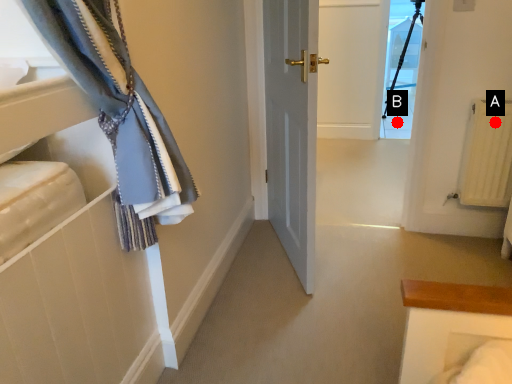
Question: Two points are circled on the image, labeled by A and B beside each circle. Which of the following is the closest to the observer?

Choices:
 (A) A is closer
 (B) B is closer

Answer: (A)